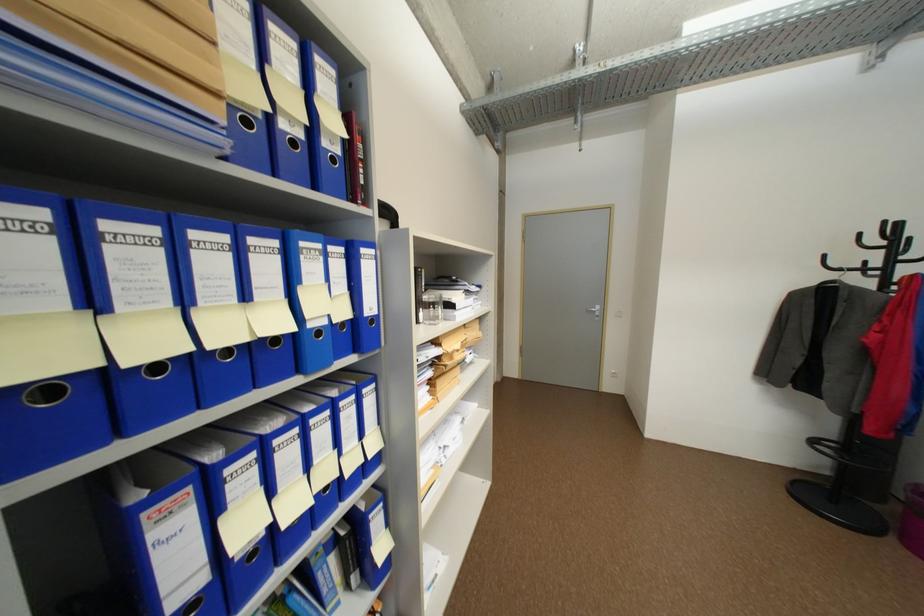
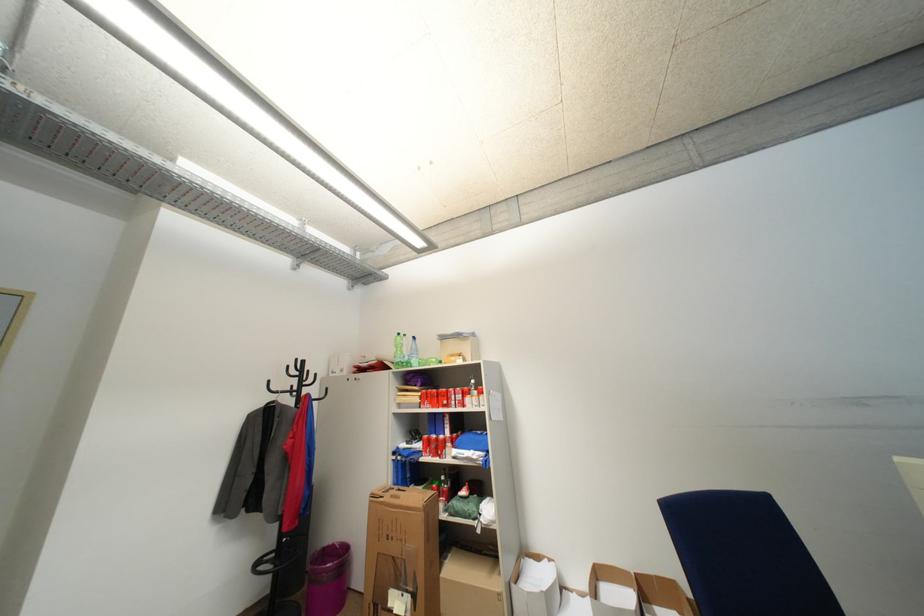
First-person continuous shooting, in which direction is the camera rotating?

The rotation direction of the camera is right-up.